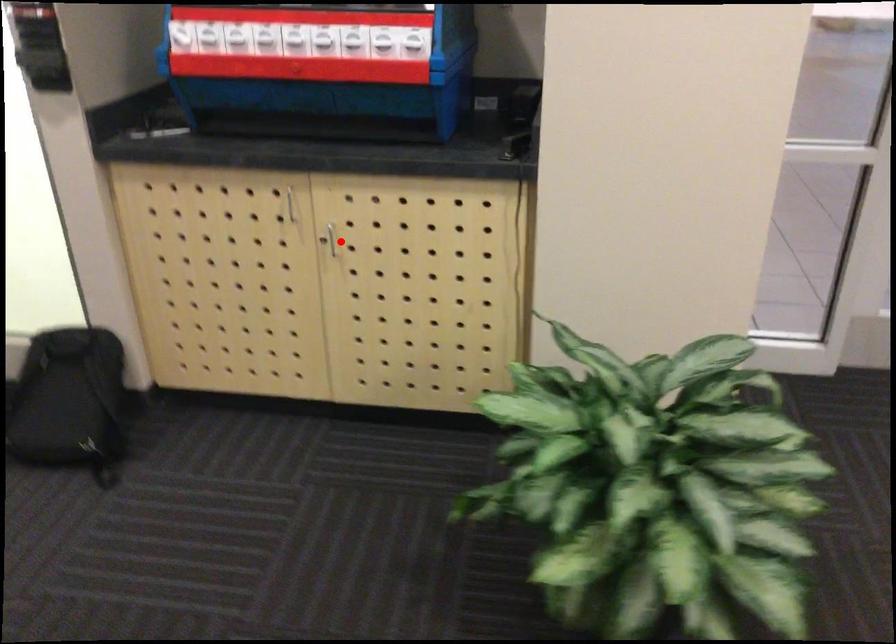
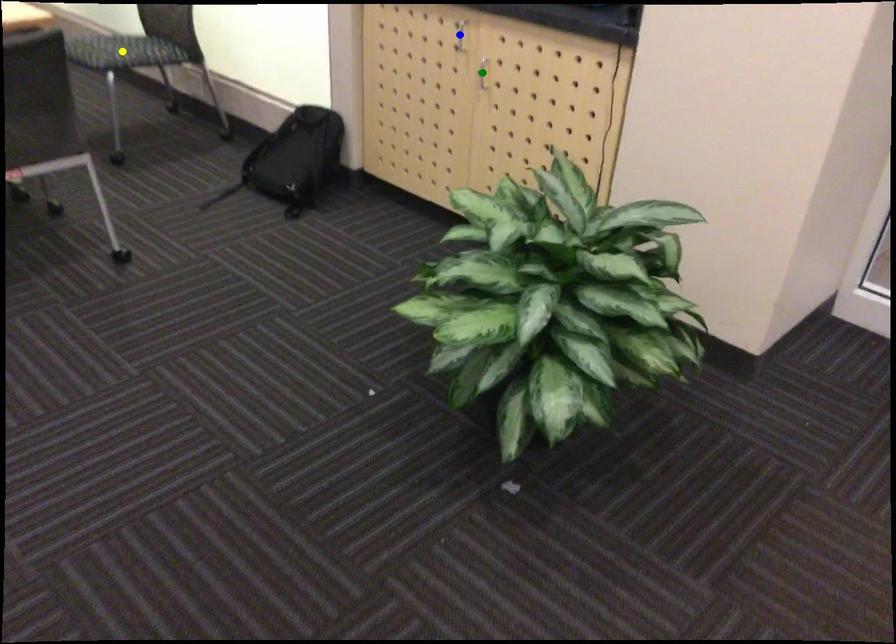
Question: I am providing you with two images of the same scene from different viewpoints. A red point is marked on the first image. You are given multiple points on the second image. In image 2, which mark is for the same physical point as the one in image 1?

Choices:
 (A) yellow point
 (B) green point
 (C) blue point

Answer: (B)